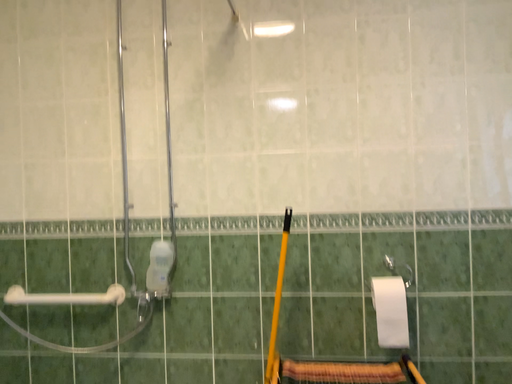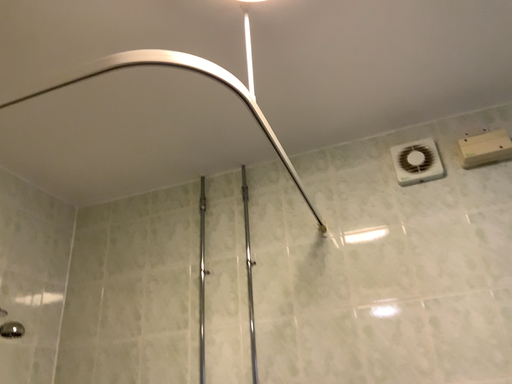
Question: How did the camera likely rotate when shooting the video?

Choices:
 (A) rotated upward
 (B) rotated downward

Answer: (A)